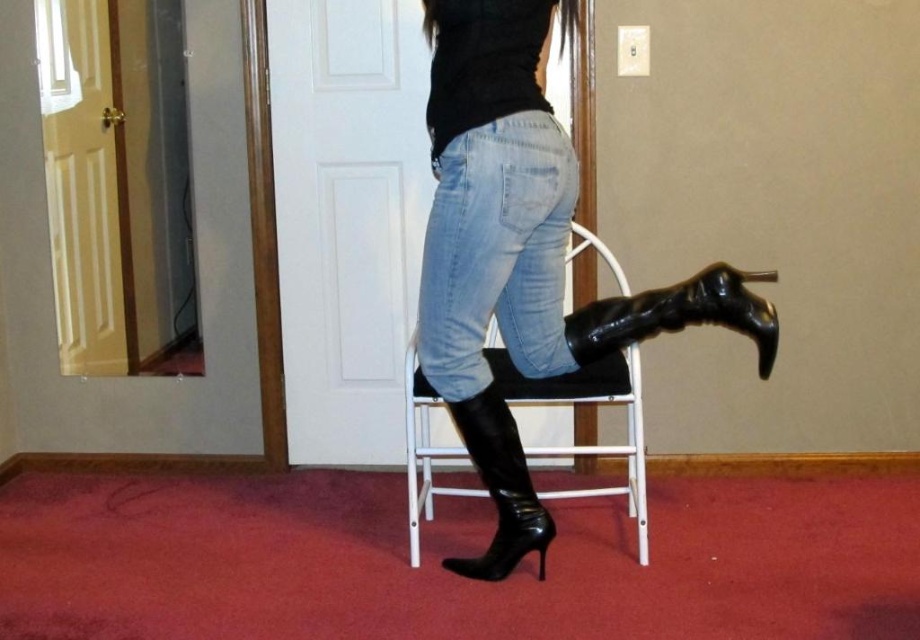
Question: Does shiny black boots at center appear under black leather boot at lower right?

Choices:
 (A) no
 (B) yes

Answer: (A)

Question: Which of the following is the closest to the observer?

Choices:
 (A) (527, 508)
 (B) (470, 152)
 (C) (640, 401)

Answer: (B)

Question: Is light blue denim jeans at center positioned in front of black leather bar stool at center?

Choices:
 (A) yes
 (B) no

Answer: (A)

Question: Can you confirm if shiny black boots at center is smaller than black leather boot at lower right?

Choices:
 (A) no
 (B) yes

Answer: (A)

Question: Which point appears closest to the camera in this image?

Choices:
 (A) (516, 262)
 (B) (474, 412)
 (C) (581, 236)
 (D) (462, 307)

Answer: (D)

Question: Which of the following is the farthest from the observer?

Choices:
 (A) shiny black boots at center
 (B) black leather boot at lower right
 (C) shiny black boot at lower center
 (D) black leather bar stool at center

Answer: (D)